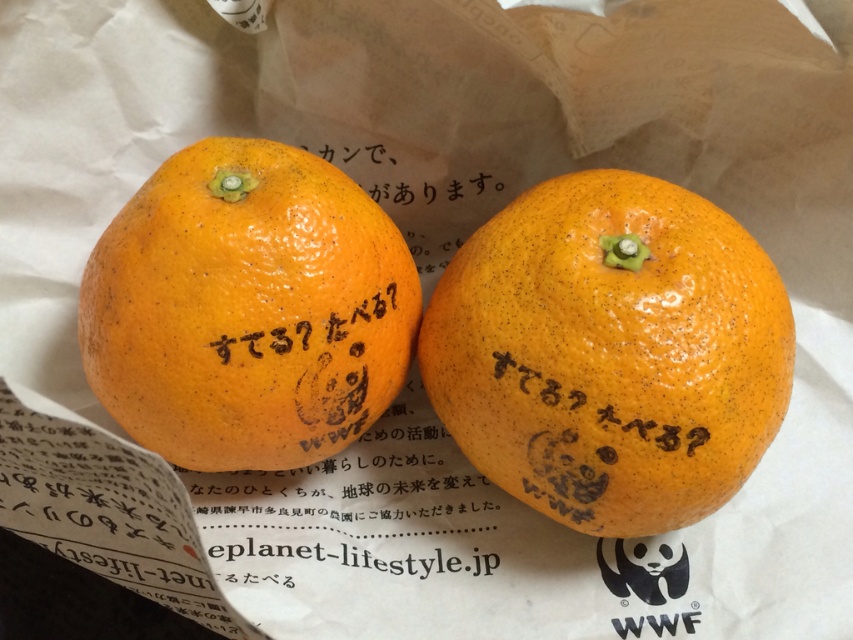
Which of these two, orangesmoothorange at center or orangesmoothorange at left, stands shorter?

orangesmoothorange at left is shorter.

Can you confirm if orangesmoothorange at center is taller than orangesmoothorange at left?

Correct, orangesmoothorange at center is much taller as orangesmoothorange at left.

Is point (596, 300) farther from viewer compared to point (339, 292)?

No, it is not.

You are a GUI agent. You are given a task and a screenshot of the screen. Output one action in this format:
    pyautogui.click(x=<x>, y=<y>)
    Task: Click on the orangesmoothorange at center
    
    Given the screenshot: What is the action you would take?
    pyautogui.click(x=610, y=352)